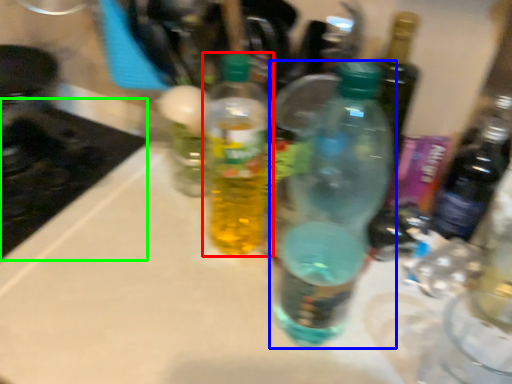
Question: Based on their relative distances, which object is farther from bottle (highlighted by a red box)? Choose from bottle (highlighted by a blue box) and appliance (highlighted by a green box).

Choices:
 (A) bottle
 (B) appliance

Answer: (B)